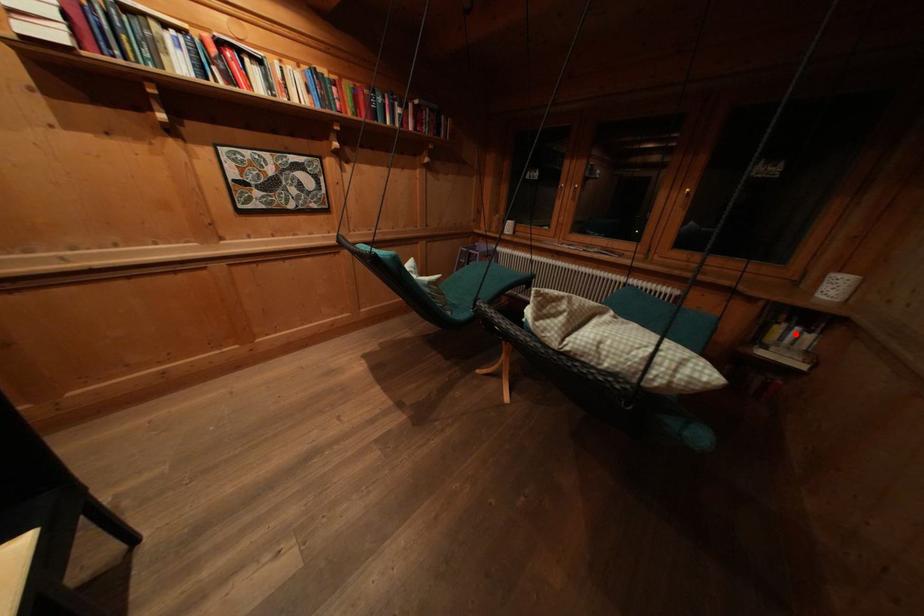
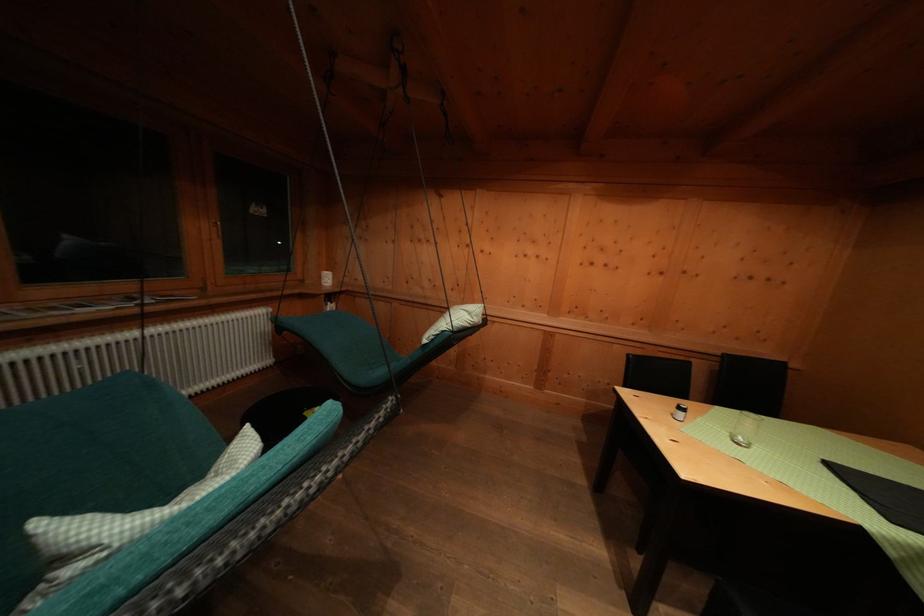
Question: A red point is marked in image1. In image2, is the corresponding 3D point closer to the camera or farther? Reply with the corresponding letter.

Choices:
 (A) The corresponding 3D point is closer.
 (B) The corresponding 3D point is farther.

Answer: (B)